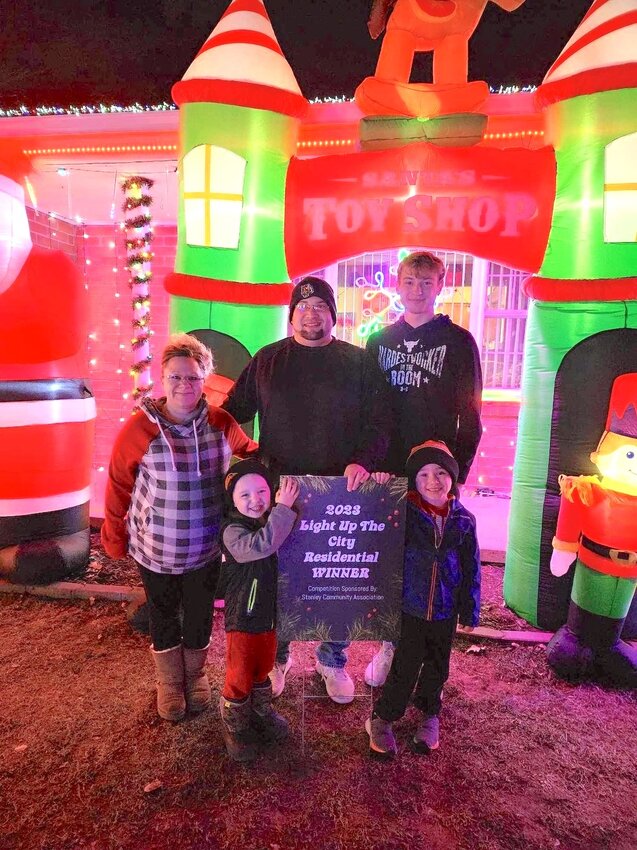
At what (x,y) coordinates should I click in order to perform the action: click on christmas tree border. Please return your answer as a coordinate pair (x, y). This screenshot has height=850, width=637. Looking at the image, I should click on (394, 491).